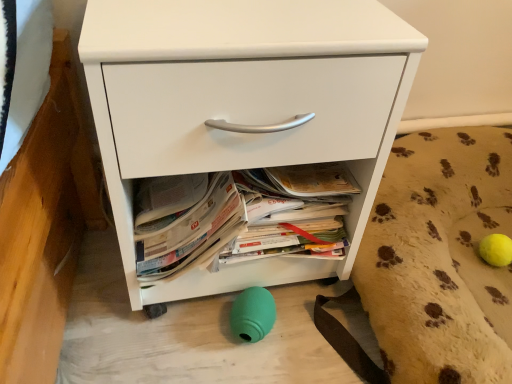
Question: Is beige textured dog bed at lower right taller or shorter than white matte chest of drawers at center?

Choices:
 (A) short
 (B) tall

Answer: (A)

Question: Looking at their shapes, would you say beige textured dog bed at lower right is wider or thinner than white matte chest of drawers at center?

Choices:
 (A) wide
 (B) thin

Answer: (A)

Question: From a real-world perspective, is beige textured dog bed at lower right positioned above or below white matte chest of drawers at center?

Choices:
 (A) above
 (B) below

Answer: (B)

Question: Does point (304, 38) appear closer or farther from the camera than point (378, 195)?

Choices:
 (A) farther
 (B) closer

Answer: (B)

Question: From the image's perspective, is white matte chest of drawers at center above or below beige textured dog bed at lower right?

Choices:
 (A) above
 (B) below

Answer: (A)

Question: Considering their positions, is white matte chest of drawers at center located in front of or behind beige textured dog bed at lower right?

Choices:
 (A) front
 (B) behind

Answer: (A)

Question: In terms of height, does white matte chest of drawers at center look taller or shorter compared to beige textured dog bed at lower right?

Choices:
 (A) short
 (B) tall

Answer: (B)